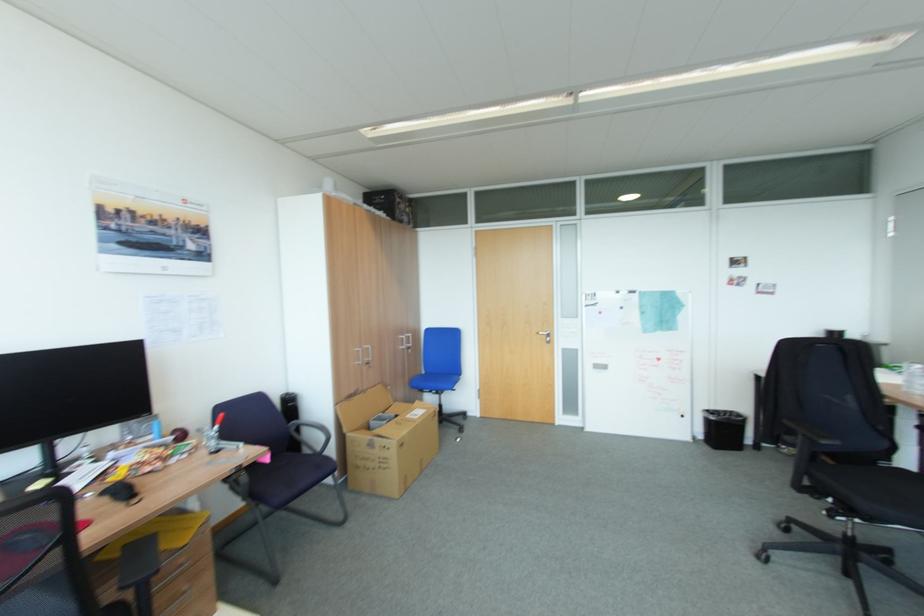
Locate an element on the screen. This screenshot has height=616, width=924. cardboard box is located at coordinates (386, 440).